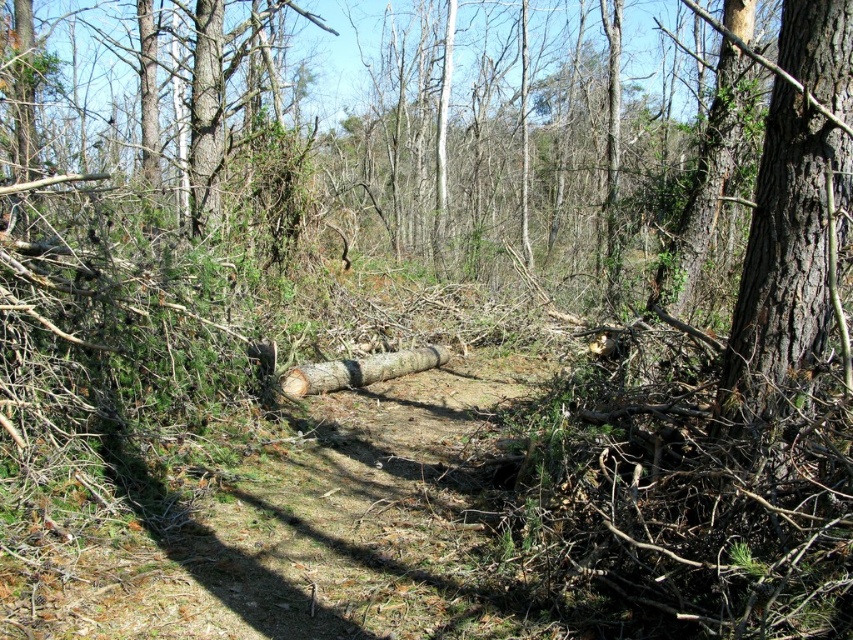
Question: Is smooth brown bark at right smaller than brown rough log at center?

Choices:
 (A) no
 (B) yes

Answer: (A)

Question: Which point appears closest to the camera in this image?

Choices:
 (A) (300, 378)
 (B) (801, 140)

Answer: (B)

Question: Does smooth brown bark at right appear under brown rough log at center?

Choices:
 (A) yes
 (B) no

Answer: (B)

Question: Can you confirm if smooth brown bark at right is smaller than brown rough log at center?

Choices:
 (A) yes
 (B) no

Answer: (B)